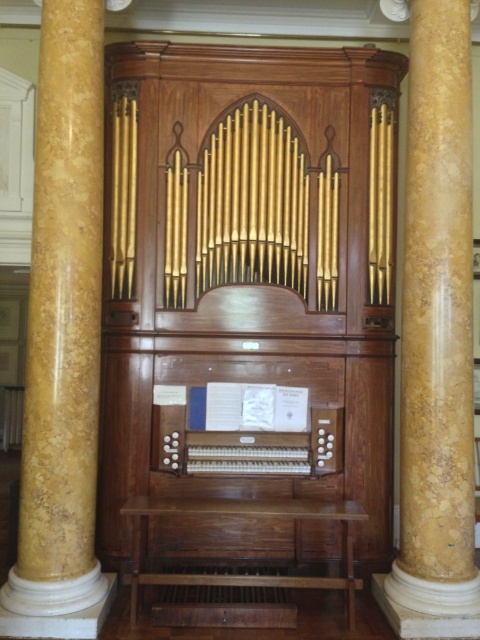
You are standing in the grand hall and want to take a closer look at the marble column at right and the wooden organ at center. Which object will appear larger in your field of view as you approach it first?

The marble column at right will appear larger in your field of view because it is closer to you than the wooden organ at center.

Looking at this image, you are standing in the grand hall and want to locate the marble column at center. According to the coordinates provided, where should you look?

The marble column at center is located at point coordinates of (62, 332).